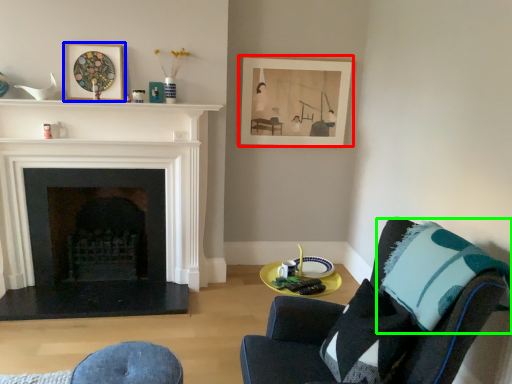
Question: Which is nearer to the picture frame (highlighted by a red box)? picture frame (highlighted by a blue box) or throw pillow (highlighted by a green box).

Choices:
 (A) picture frame
 (B) throw pillow

Answer: (A)